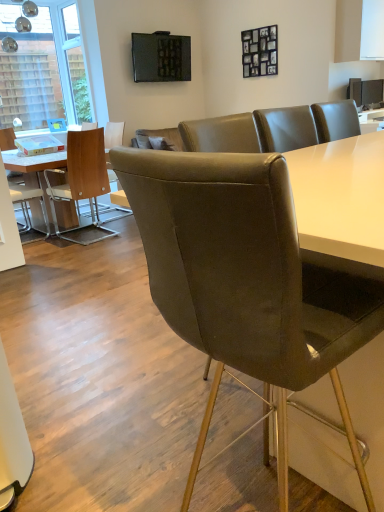
Question: From the image's perspective, is matte black tv at upper center, which is counted as the 2th television, starting from the top, located above transparent glass window at upper left?

Choices:
 (A) yes
 (B) no

Answer: (B)

Question: Does matte black tv at upper center, which is counted as the 2th television, starting from the top, come behind transparent glass window at upper left?

Choices:
 (A) yes
 (B) no

Answer: (B)

Question: Is matte black tv at upper center, the 1th television when ordered from bottom to top, far from transparent glass window at upper left?

Choices:
 (A) yes
 (B) no

Answer: (A)

Question: Is matte black tv at upper center, the 1th television when ordered from bottom to top, oriented towards transparent glass window at upper left?

Choices:
 (A) no
 (B) yes

Answer: (A)

Question: Considering the relative sizes of matte black tv at upper center, the first television from the right, and transparent glass window at upper left in the image provided, is matte black tv at upper center, the first television from the right, thinner than transparent glass window at upper left?

Choices:
 (A) no
 (B) yes

Answer: (A)

Question: Is matte black tv at upper center, which is counted as the 2th television, starting from the top, looking in the opposite direction of transparent glass window at upper left?

Choices:
 (A) no
 (B) yes

Answer: (A)

Question: Can you confirm if matte brown chair at left, which appears as the 2th chair when viewed from the left, is taller than white leather chair at left, placed as the first chair when sorted from back to front?

Choices:
 (A) no
 (B) yes

Answer: (B)

Question: Is matte brown chair at left, placed as the 2th chair when sorted from front to back, wider than white leather chair at left, the 1th chair when ordered from left to right?

Choices:
 (A) yes
 (B) no

Answer: (A)

Question: Is matte brown chair at left, which appears as the 2th chair when viewed from the left, to the right of white leather chair at left, placed as the first chair when sorted from back to front, from the viewer's perspective?

Choices:
 (A) no
 (B) yes

Answer: (B)

Question: Is matte brown chair at left, the second chair when ordered from back to front, not within white leather chair at left, which ranks as the 3th chair in right-to-left order?

Choices:
 (A) no
 (B) yes

Answer: (B)

Question: Is matte brown chair at left, the second chair from the right, positioned in front of white leather chair at left, placed as the first chair when sorted from back to front?

Choices:
 (A) yes
 (B) no

Answer: (A)

Question: From a real-world perspective, is matte brown chair at left, the second chair from the right, physically above white leather chair at left, which ranks as the 3th chair in right-to-left order?

Choices:
 (A) yes
 (B) no

Answer: (A)

Question: Can you confirm if white leather chair at left, which ranks as the 3th chair in right-to-left order, is positioned to the right of matte black tv at upper center, the second television from the bottom?

Choices:
 (A) yes
 (B) no

Answer: (B)